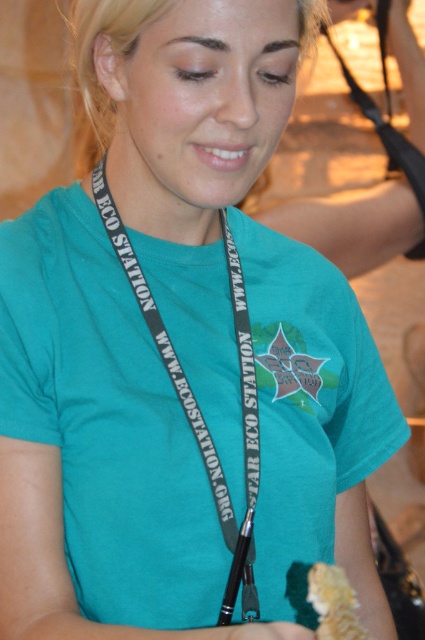
Who is more forward, (371, 106) or (328, 627)?

Point (328, 627) is in front.

Looking at this image, which is below, black fabric strap at upper right or yellow crumbly food at lower right?

yellow crumbly food at lower right is below.

Find the location of `black fabric strap at upper right`. black fabric strap at upper right is located at coordinates (387, 113).

Is black fabric lanyard at center bigger than black lanyard at center?

Yes, black fabric lanyard at center is bigger than black lanyard at center.

Does point (186, 406) come behind point (184, 180)?

Yes.

Where is `black fabric lanyard at center`? The height and width of the screenshot is (640, 425). black fabric lanyard at center is located at coordinates (195, 400).

From the picture: Can you confirm if black lanyard at center is taller than yellow crumbly food at lower right?

Yes.

Which is behind, point (115, 129) or point (325, 616)?

Point (115, 129)

Locate an element on the screen. Image resolution: width=425 pixels, height=640 pixels. black lanyard at center is located at coordinates (163, 182).

Identify the location of black lanyard at center. Image resolution: width=425 pixels, height=640 pixels. (163, 182).